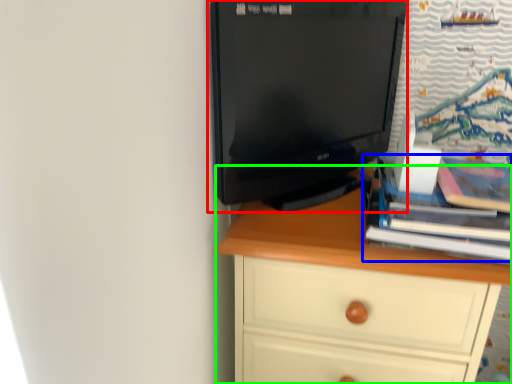
Question: Which is farther away from computer monitor (highlighted by a red box)? book (highlighted by a blue box) or chest of drawers (highlighted by a green box)?

Choices:
 (A) book
 (B) chest of drawers

Answer: (A)